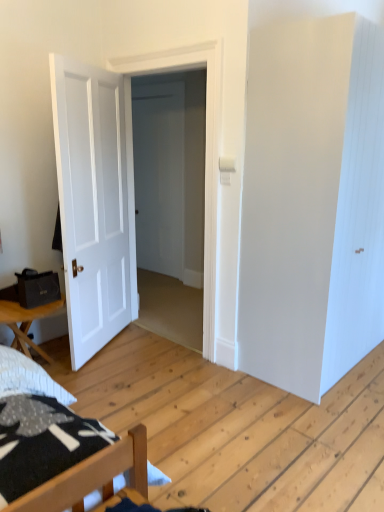
Question: Does wooden table at lower left turn towards white matte door at left, arranged as the second door when viewed from the right?

Choices:
 (A) yes
 (B) no

Answer: (B)

Question: Can you confirm if wooden table at lower left is bigger than white matte door at left, which appears as the first door when viewed from the left?

Choices:
 (A) no
 (B) yes

Answer: (A)

Question: Is white matte door at left, which appears as the first door when viewed from the left, located within wooden table at lower left?

Choices:
 (A) yes
 (B) no

Answer: (B)

Question: From a real-world perspective, does wooden table at lower left stand above white matte door at left, arranged as the second door when viewed from the right?

Choices:
 (A) yes
 (B) no

Answer: (B)

Question: Does wooden table at lower left have a smaller size compared to white matte door at left, which appears as the first door when viewed from the left?

Choices:
 (A) no
 (B) yes

Answer: (B)

Question: Considering the relative sizes of wooden table at lower left and white matte door at left, arranged as the second door when viewed from the right, in the image provided, is wooden table at lower left shorter than white matte door at left, arranged as the second door when viewed from the right,?

Choices:
 (A) yes
 (B) no

Answer: (A)

Question: Are white matte door at left, which appears as the first door when viewed from the left, and white smooth door at center, the 2th door from the left, far apart?

Choices:
 (A) yes
 (B) no

Answer: (B)

Question: Can you confirm if white matte door at left, which appears as the first door when viewed from the left, is thinner than white smooth door at center, the first door when ordered from right to left?

Choices:
 (A) yes
 (B) no

Answer: (A)

Question: Considering the relative positions of white matte door at left, which appears as the first door when viewed from the left, and white smooth door at center, the first door when ordered from right to left, in the image provided, is white matte door at left, which appears as the first door when viewed from the left, to the right of white smooth door at center, the first door when ordered from right to left, from the viewer's perspective?

Choices:
 (A) no
 (B) yes

Answer: (A)

Question: Can white smooth door at center, the 2th door from the left, be found inside white matte door at left, which appears as the first door when viewed from the left?

Choices:
 (A) no
 (B) yes

Answer: (A)

Question: Is white matte door at left, arranged as the second door when viewed from the right, bigger than white smooth door at center, the first door when ordered from right to left?

Choices:
 (A) yes
 (B) no

Answer: (B)

Question: Is white matte door at left, which appears as the first door when viewed from the left, shorter than white smooth door at center, the 2th door from the left?

Choices:
 (A) no
 (B) yes

Answer: (B)

Question: Is white matte door at left, which appears as the first door when viewed from the left, with wooden table at lower left?

Choices:
 (A) no
 (B) yes

Answer: (A)